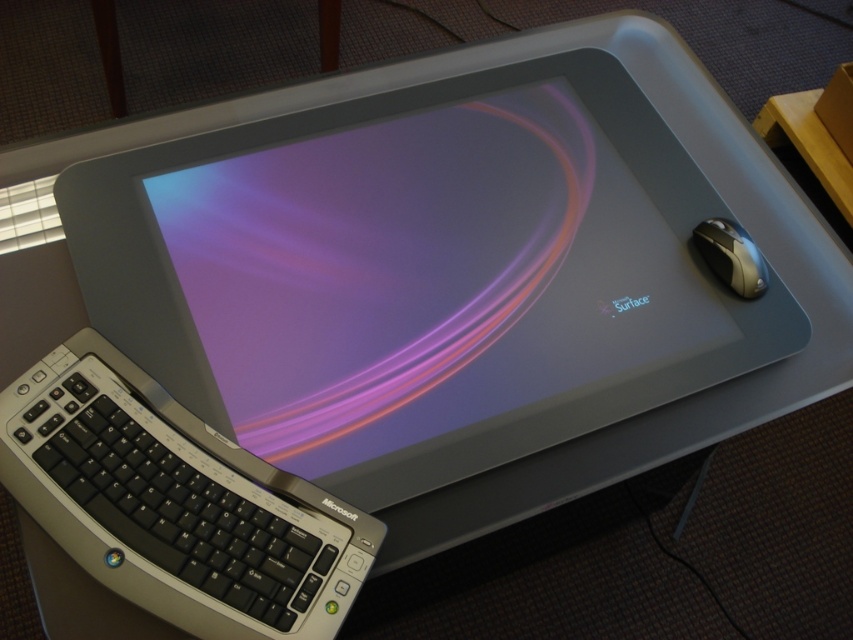
Does black plastic keyboard at lower left appear on the left side of silver metallic mouse at right?

Yes, black plastic keyboard at lower left is to the left of silver metallic mouse at right.

Which is more to the right, black plastic keyboard at lower left or silver metallic mouse at right?

Positioned to the right is silver metallic mouse at right.

The height and width of the screenshot is (640, 853). Describe the element at coordinates (165, 509) in the screenshot. I see `black plastic keyboard at lower left` at that location.

This screenshot has height=640, width=853. Identify the location of black plastic keyboard at lower left. (165, 509).